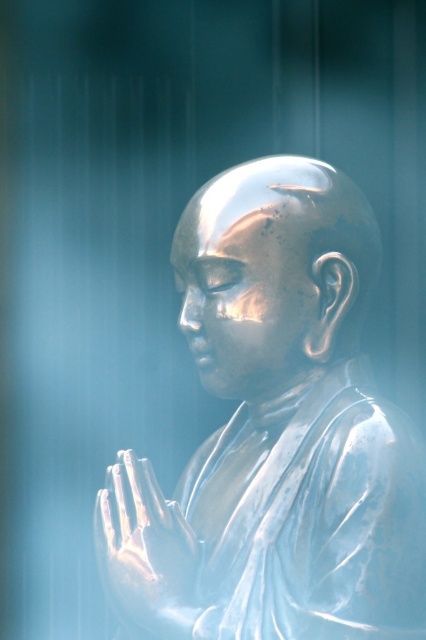
You are an art conservator assessing the statue. You need to determine if the shiny silver monk at center can fit into a storage box designed for objects narrower than the shiny metallic head at center. Can it fit?

The shiny silver monk at center is wider than the shiny metallic head at center, so it cannot fit into a storage box designed for objects narrower than the shiny metallic head at center.

You are a photographer trying to capture the shiny silver monk at center and the shiny metallic head at center in a single shot. Based on their positions, which one is closer to the camera?

The shiny silver monk at center is positioned under the shiny metallic head at center, so the shiny metallic head at center is closer to the camera.

You are standing 10 feet away from a shiny silver monk at center. Can you safely approach it to touch without moving your feet?

The shiny silver monk at center is 10.12 feet away from you, so you cannot reach it without moving your feet since you are only 10 feet away.